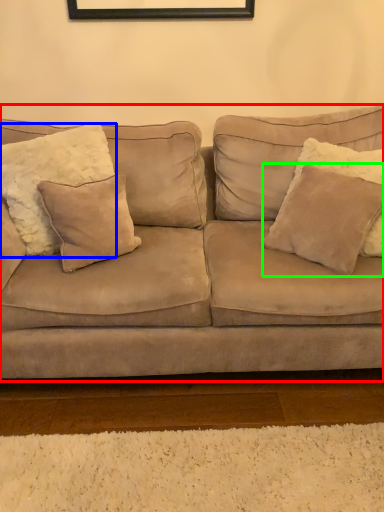
Question: Considering the real-world distances, which object is closest to studio couch (highlighted by a red box)? pillow (highlighted by a blue box) or pillow (highlighted by a green box).

Choices:
 (A) pillow
 (B) pillow

Answer: (B)